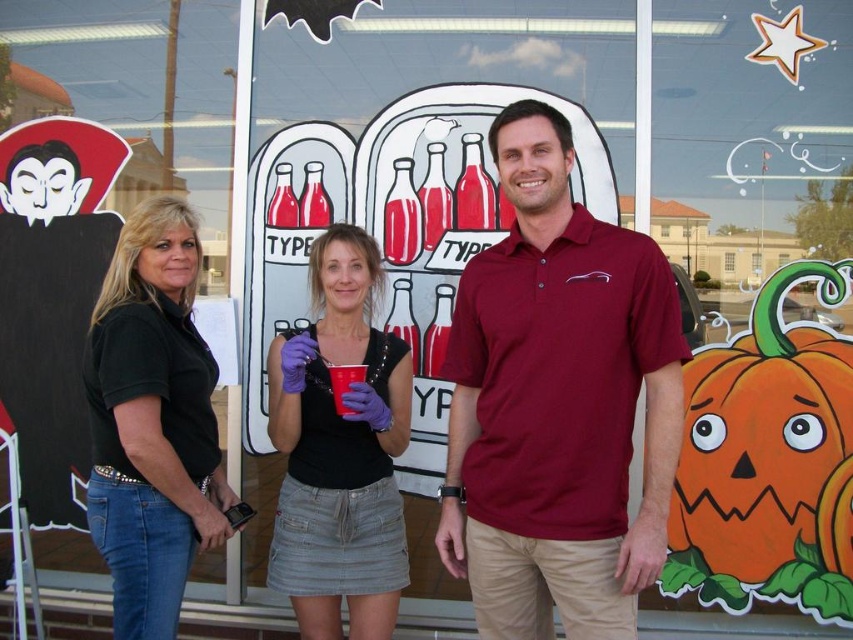
Question: Does maroon polo shirt at center have a smaller size compared to black denim jeans at left?

Choices:
 (A) yes
 (B) no

Answer: (B)

Question: Which object is positioned closest to the black denim jeans at left?

Choices:
 (A) maroon polo shirt at center
 (B) black denim skirt at center

Answer: (B)

Question: Does black denim jeans at left appear over black denim skirt at center?

Choices:
 (A) no
 (B) yes

Answer: (B)

Question: Which point is closer to the camera taking this photo?

Choices:
 (A) (341, 262)
 (B) (621, 493)

Answer: (B)

Question: Which point appears farthest from the camera in this image?

Choices:
 (A) (212, 529)
 (B) (404, 570)
 (C) (527, 166)

Answer: (B)

Question: Does maroon polo shirt at center come behind black denim skirt at center?

Choices:
 (A) yes
 (B) no

Answer: (B)